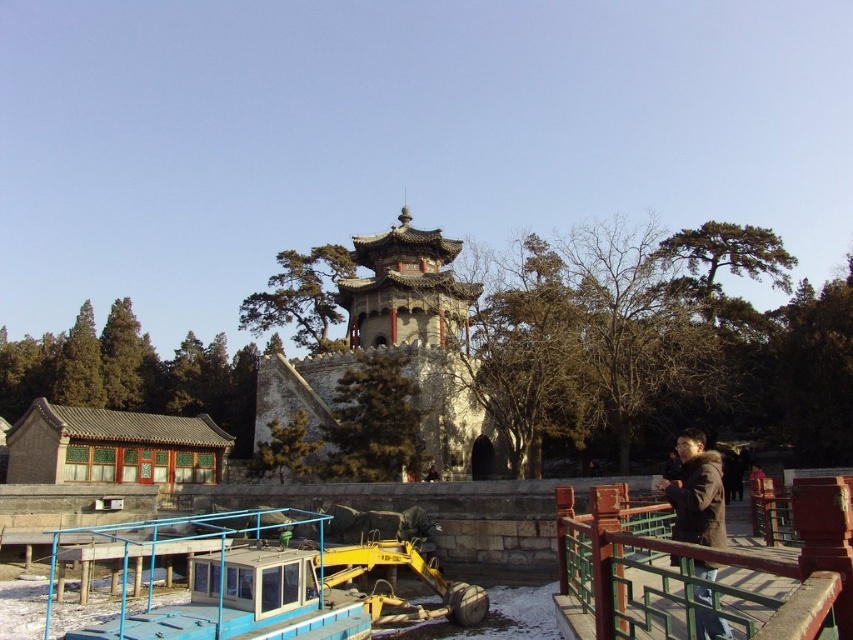
Does green painted wood bridge at lower right have a greater height compared to brown fuzzy jacket at lower right?

Indeed, green painted wood bridge at lower right has a greater height compared to brown fuzzy jacket at lower right.

How far apart are green painted wood bridge at lower right and brown fuzzy jacket at lower right?

green painted wood bridge at lower right is 7.45 feet away from brown fuzzy jacket at lower right.

Who is more forward, (671, 538) or (718, 490)?

Positioned in front is point (718, 490).

Identify the location of green painted wood bridge at lower right. (701, 572).

Does green painted wood bridge at lower right have a greater width compared to stone textured pagoda at center?

No, green painted wood bridge at lower right is not wider than stone textured pagoda at center.

This screenshot has height=640, width=853. Identify the location of green painted wood bridge at lower right. (701, 572).

Is point (769, 577) in front of point (497, 474)?

Yes, it is.

Locate an element on the screen. green painted wood bridge at lower right is located at coordinates (701, 572).

What do you see at coordinates (399, 348) in the screenshot? I see `stone textured pagoda at center` at bounding box center [399, 348].

Looking at this image, who is taller, stone textured pagoda at center or brown fuzzy jacket at lower right?

stone textured pagoda at center

Does point (350, 330) come in front of point (689, 512)?

No, (350, 330) is behind (689, 512).

The image size is (853, 640). Find the location of `stone textured pagoda at center`. stone textured pagoda at center is located at coordinates (399, 348).